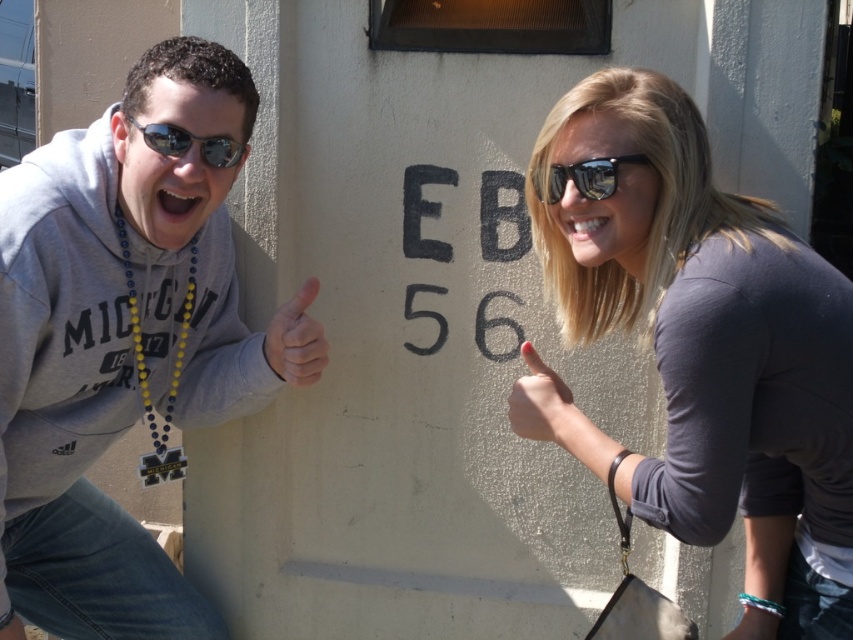
Question: Which object is farther from the camera taking this photo?

Choices:
 (A) matte gray hand at center
 (B) matte skin at center

Answer: (A)

Question: Observing the image, what is the correct spatial positioning of gray sweatshirt at left in reference to sunglasses at left?

Choices:
 (A) right
 (B) left

Answer: (B)

Question: Based on their relative distances, which object is farther from the reflective plastic sunglasses at upper right?

Choices:
 (A) matte skin at center
 (B) sunglasses at left
 (C) matte gray hand at center
 (D) matte gray shirt at right

Answer: (B)

Question: Is matte gray shirt at right closer to the viewer compared to sunglasses at left?

Choices:
 (A) no
 (B) yes

Answer: (B)

Question: Does matte skin at center have a lesser width compared to sunglasses at left?

Choices:
 (A) yes
 (B) no

Answer: (A)

Question: Which point is closer to the camera taking this photo?

Choices:
 (A) (20, 163)
 (B) (573, 428)
 (C) (227, 141)
 (D) (611, 192)

Answer: (D)